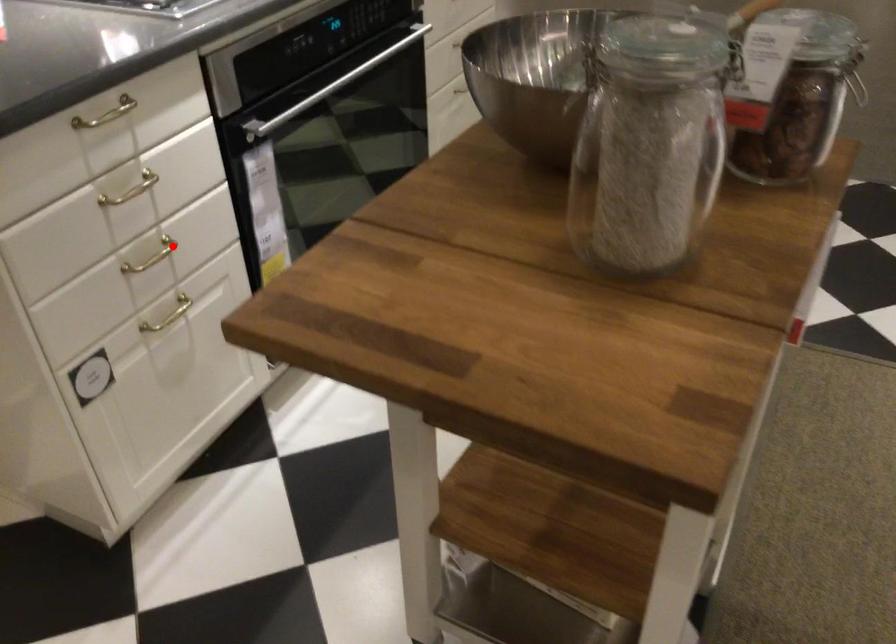
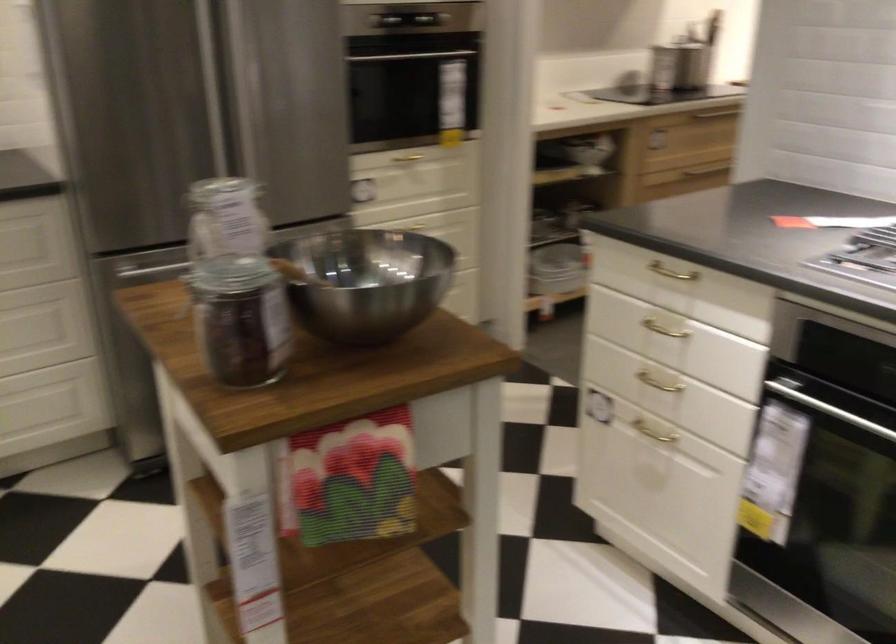
In the second image, find the point that corresponds to the highlighted location in the first image.

(659, 383)